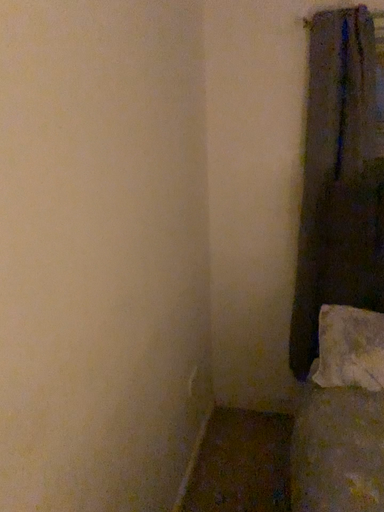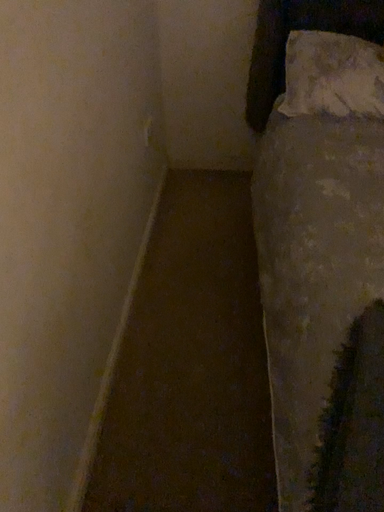
Question: Which way did the camera rotate in the video?

Choices:
 (A) rotated right
 (B) rotated left

Answer: (A)